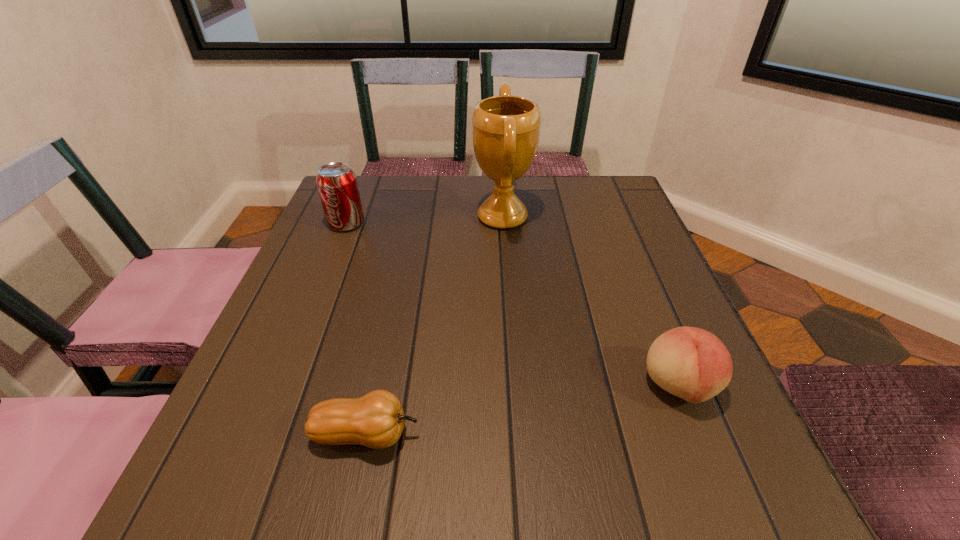
Find the location of a particular element. The width and height of the screenshot is (960, 540). vacant area situated on the front of the third object from left to right with the decoration is located at coordinates (425, 217).

Locate an element on the screen. The width and height of the screenshot is (960, 540). vacant region located 0.140m on the back of the third shortest object is located at coordinates (362, 186).

Where is `vacant region located on the left of the peach`? The width and height of the screenshot is (960, 540). vacant region located on the left of the peach is located at coordinates (455, 386).

The image size is (960, 540). Identify the location of vacant space located on the stem side of the gourd. (684, 434).

The height and width of the screenshot is (540, 960). What are the coordinates of `award that is positioned at the far edge` in the screenshot? It's located at (506, 129).

I want to click on soda can at the far edge, so click(x=337, y=185).

Find the location of `object positioned at the near edge`. object positioned at the near edge is located at coordinates 376,420.

Locate an element on the screen. The image size is (960, 540). soda can present at the left edge is located at coordinates (337, 185).

Locate an element on the screen. The image size is (960, 540). gourd present at the left edge is located at coordinates (376, 420).

Locate an element on the screen. The image size is (960, 540). object positioned at the right edge is located at coordinates (691, 363).